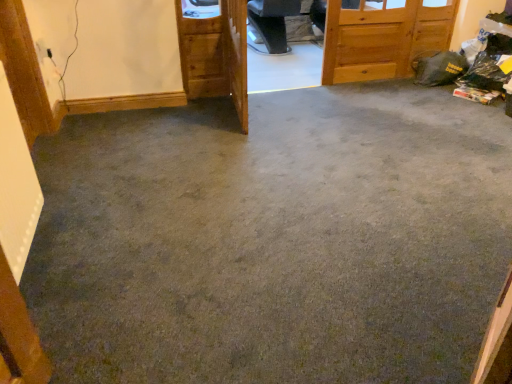
I want to click on wooden door at right, so click(x=382, y=39).

The height and width of the screenshot is (384, 512). What do you see at coordinates (382, 39) in the screenshot?
I see `wooden door at right` at bounding box center [382, 39].

Where is `wooden door at right`? wooden door at right is located at coordinates (382, 39).